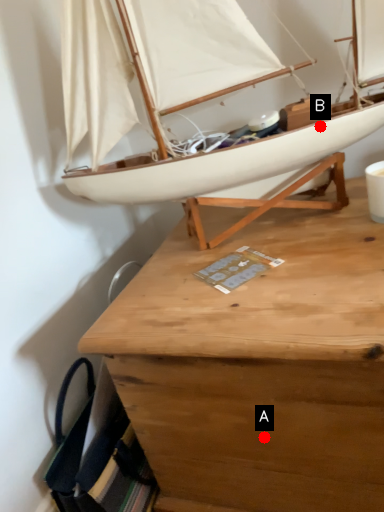
Question: Two points are circled on the image, labeled by A and B beside each circle. Which of the following is the farthest from the observer?

Choices:
 (A) A is further
 (B) B is further

Answer: (B)